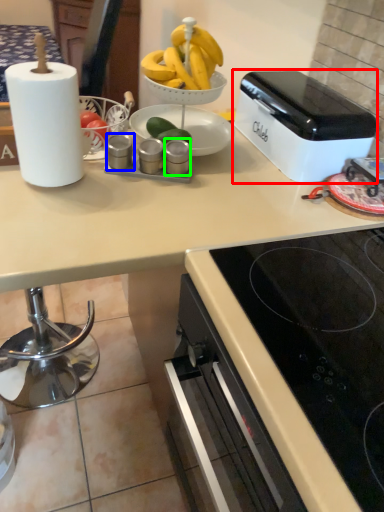
Question: Based on their relative distances, which object is farther from toaster (highlighted by a red box)? Choose from appliance (highlighted by a blue box) and appliance (highlighted by a green box).

Choices:
 (A) appliance
 (B) appliance

Answer: (A)